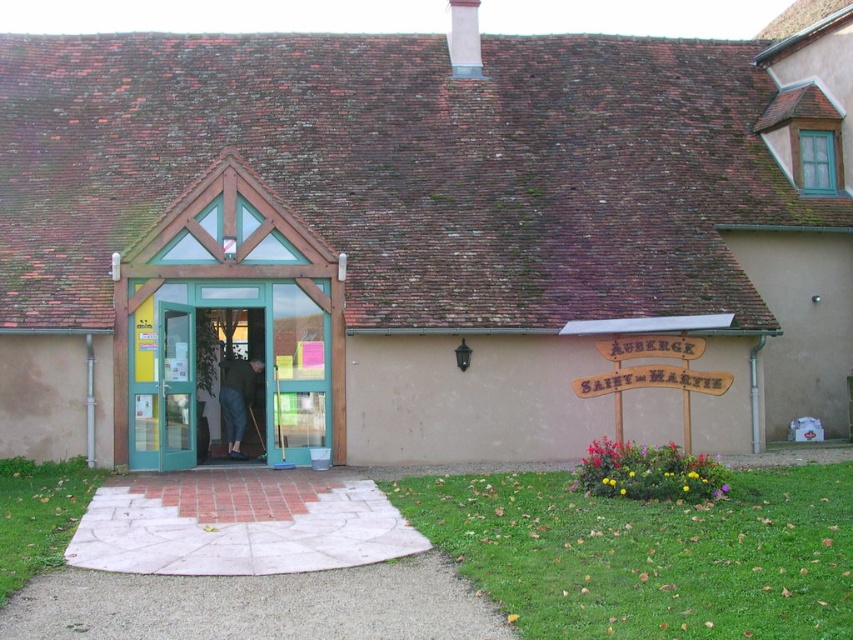
Question: Is green glass door at center bigger than dark blue jeans at center?

Choices:
 (A) no
 (B) yes

Answer: (B)

Question: Can you confirm if transparent glass door at center is wider than dark blue jeans at center?

Choices:
 (A) yes
 (B) no

Answer: (B)

Question: Can you confirm if green glass door at center is positioned to the right of dark blue jeans at center?

Choices:
 (A) no
 (B) yes

Answer: (B)

Question: Which is nearer to the transparent glass door at center?

Choices:
 (A) dark blue jeans at center
 (B) green glass door at center

Answer: (B)

Question: Based on their relative distances, which object is farther from the dark blue jeans at center?

Choices:
 (A) green glass door at center
 (B) transparent glass door at center

Answer: (A)

Question: Which point is farther to the camera?

Choices:
 (A) (236, 435)
 (B) (167, 376)

Answer: (A)